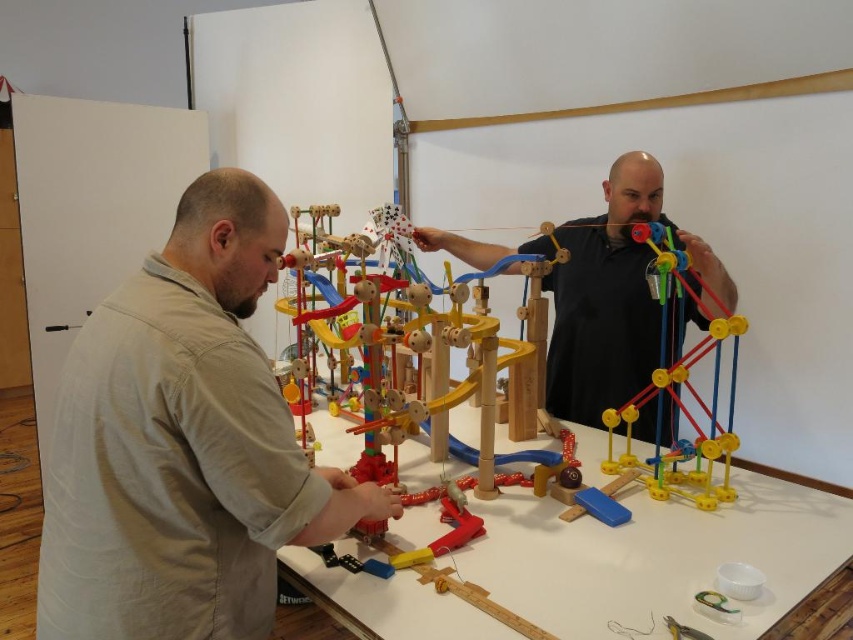
Consider the image. Can you confirm if wooden at center is positioned below black matte man at center?

Yes, wooden at center is below black matte man at center.

Is the position of wooden at center less distant than that of black matte man at center?

Yes, it is.

This screenshot has height=640, width=853. What do you see at coordinates (656, 557) in the screenshot?
I see `wooden at center` at bounding box center [656, 557].

Identify the location of wooden at center. The height and width of the screenshot is (640, 853). (656, 557).

Based on the photo, can you confirm if black matte man at center is taller than yellow plastic ball at center?

Yes, black matte man at center is taller than yellow plastic ball at center.

Measure the distance between black matte man at center and yellow plastic ball at center.

The distance of black matte man at center from yellow plastic ball at center is 7.75 inches.

Between point (660, 189) and point (654, 413), which one is positioned in front?

Point (660, 189) is in front.

The image size is (853, 640). In order to click on black matte man at center in this screenshot , I will do click(x=613, y=296).

Between point (247, 362) and point (535, 572), which one is positioned behind?

The point (535, 572) is behind.

Which is in front, point (223, 522) or point (310, 573)?

Point (223, 522) is more forward.

The height and width of the screenshot is (640, 853). Identify the location of light beige shirt at center. click(x=183, y=444).